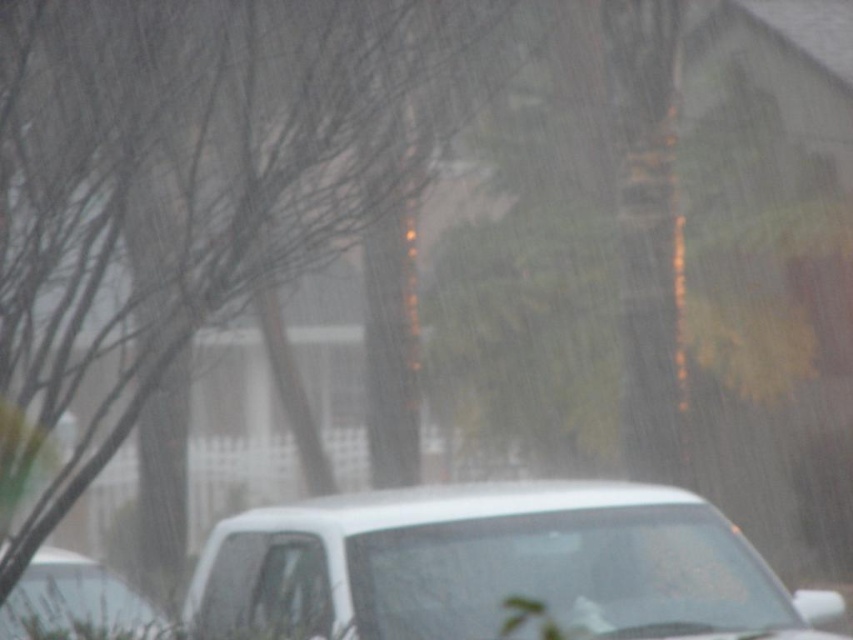
You are a driver in the white matte car at lower center. You want to merge into the lane where the white matte car at lower left is driving. Is your car bigger than the other car in the lower left?

The white matte car at lower center is larger in size than the white matte car at lower left, so yes, your car is bigger than the other car in the lower left.

You are a pedestrian standing at the point labeled as point (495, 566) in the image. You want to walk to the nearest building. Which direction should you head towards?

The point (495, 566) corresponds to the white matte car at lower center. To reach the nearest building, you should head towards the direction where the residential structures are located behind the trees in the midground.

You are a driver in a white matte car at lower center. You want to pass the white matte car at lower left ahead of you. Can you safely pass the car on the right side?

The white matte car at lower center is much taller than the white matte car at lower left, but the question of passing safely on the right side depends on road conditions and visibility, which are not specified in the scene description. The scene mentions rain reducing visibility, so passing might be unsafe due to poor visibility caused by the rain.